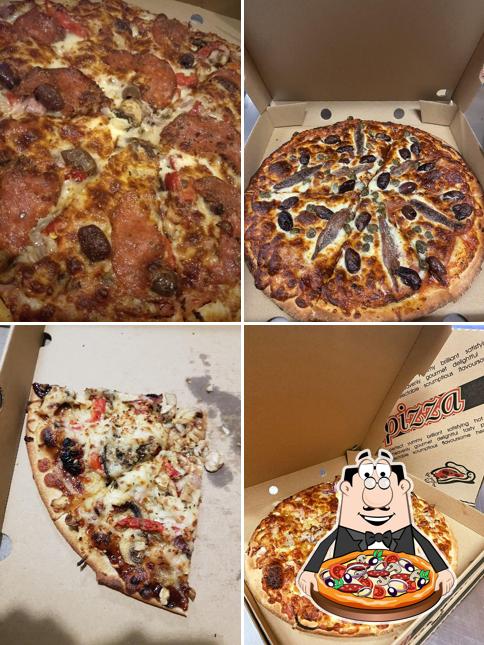
Identify the location of box. (282, 460), (23, 404), (375, 104), (231, 10).